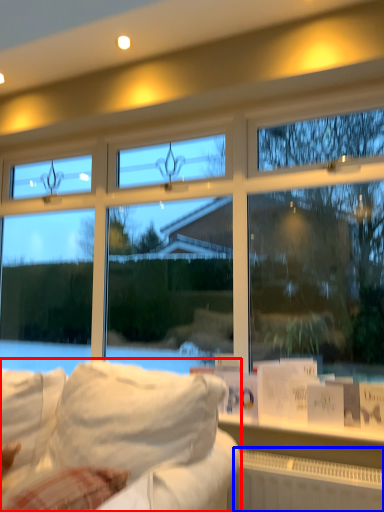
Question: Which point is further to the camera, studio couch (highlighted by a red box) or radiator (highlighted by a blue box)?

Choices:
 (A) studio couch
 (B) radiator

Answer: (B)